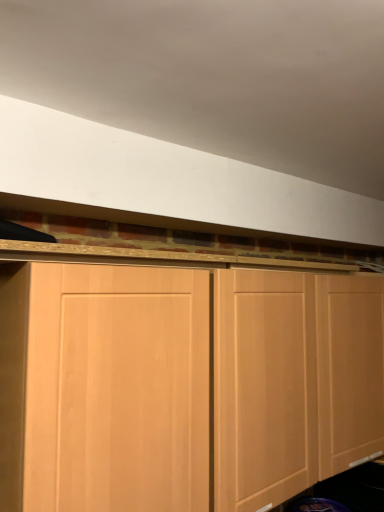
Describe the element at coordinates (187, 384) in the screenshot. I see `light wood cabinet at center` at that location.

What is the approximate width of light wood cabinet at center?

31.64 centimeters.

Find the location of a particular element. The image size is (384, 512). light wood cabinet at center is located at coordinates (187, 384).

Find the location of `light wood cabinet at center`. light wood cabinet at center is located at coordinates (187, 384).